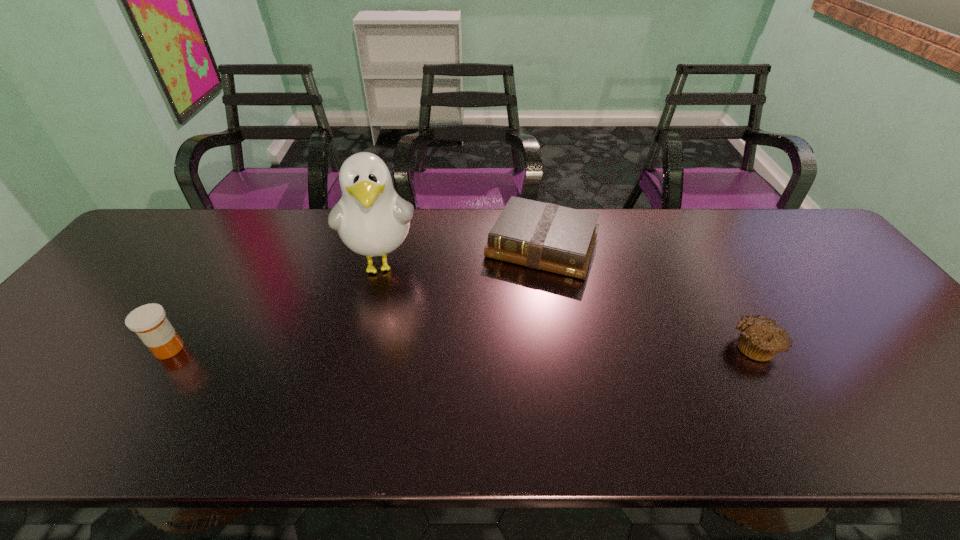
At what (x,y) coordinates should I click in order to perform the action: click on vacant space on the desktop that is between the second tallest object and the rightmost object and is positioned on the spine side of the Bible. Please return your answer as a coordinate pair (x, y). Looking at the image, I should click on (501, 347).

Locate an element on the screen. This screenshot has height=540, width=960. vacant space on the desktop that is between the medicine and the muffin and is positioned on the beak of the gull is located at coordinates (383, 348).